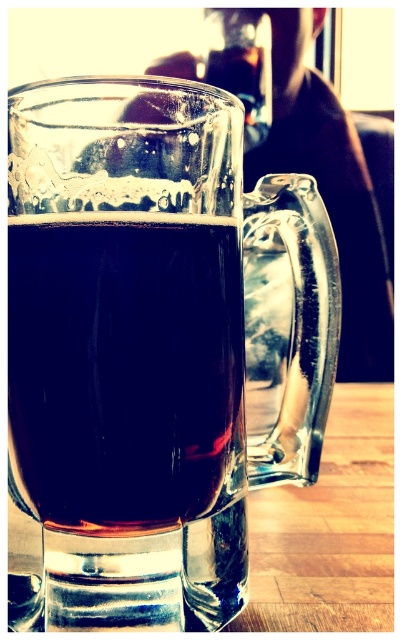
You are a bartender preparing drinks. You need to place the transparent glass mug at center and the transparent glass wine at center on a shelf. The shelf has limited space, and you must stack them vertically. Which one should you place at the bottom to ensure stability?

The transparent glass mug at center should be placed at the bottom because it is positioned under the transparent glass wine at center, indicating it is larger or sturdier.

You are a bartender who needs to place a coaster between the transparent glass mug at center and the transparent glass wine at center. The coaster has a diameter of 1 inch. Will the coaster fit between them?

The distance between the transparent glass mug at center and the transparent glass wine at center is 0.72 inches. Since the coaster has a diameter of 1 inch, which is larger than the available space, the coaster will not fit between them.

Looking at this image, you are a bartender preparing drinks for a customer. You have two glasses in front of you on the counter, a transparent glass mug at center and a transparent glass wine at center. The customer orders a drink that requires a larger glass. Which glass should you choose?

The transparent glass mug at center has a larger size compared to the transparent glass wine at center, so you should choose the transparent glass mug at center for the customer.